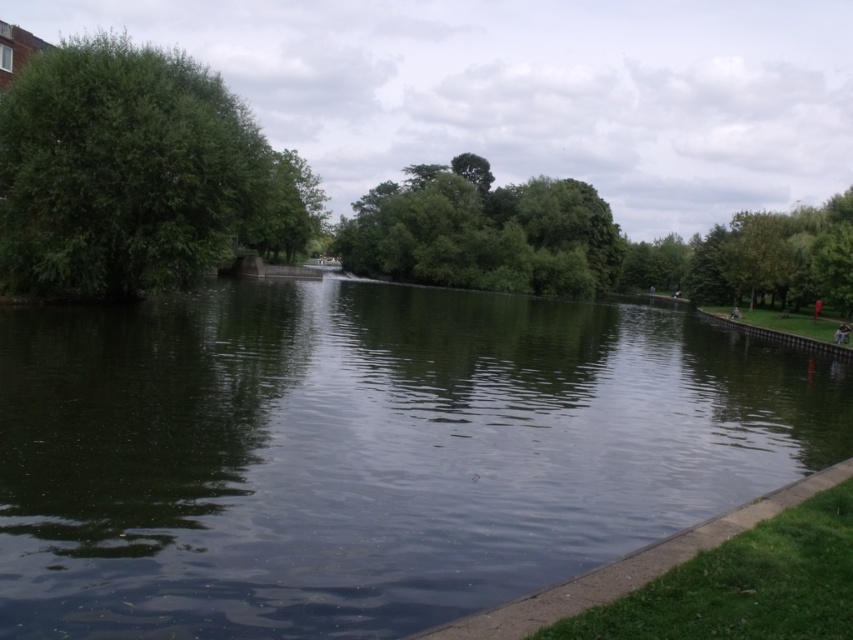
You are an environmental scientist analyzing the waterway scene. You observe the green reflective water at center and the green leafy trees at center. Which object covers a smaller area in the image?

The green reflective water at center occupies less space than the green leafy trees at center, so the green reflective water at center covers a smaller area.

Based on the photo, you are standing on the pathway next to the green reflective water at center. If you want to reach the dense cluster of trees on the left, should you walk towards the north or south?

The dense cluster of trees on the left is located north of the green reflective water at center, so you should walk towards the north.